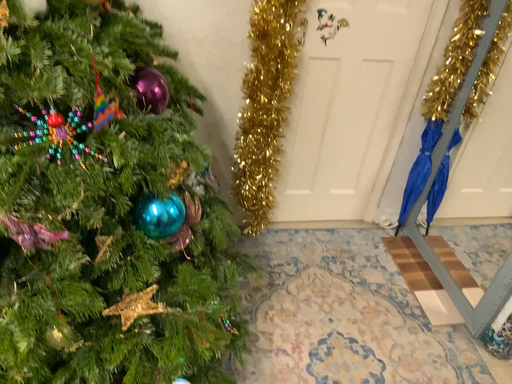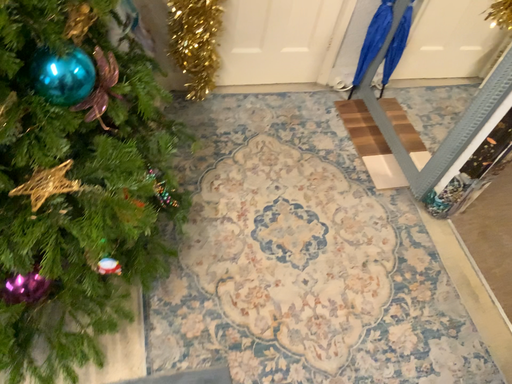
Question: Which way did the camera rotate in the video?

Choices:
 (A) rotated downward
 (B) rotated upward

Answer: (A)